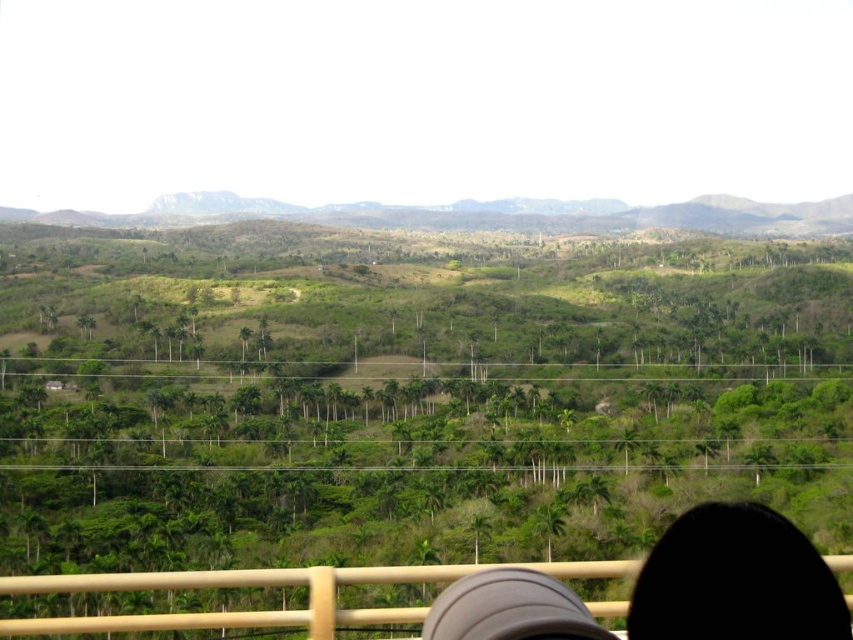
You are a hiker standing at the railing in the foreground. You notice the black hair at lower right and the green grassy hillside at upper center. Which object is shorter in height?

The black hair at lower right is shorter in height compared to the green grassy hillside at upper center as stated in the description.

You are standing on the bridge and want to compare the sizes of the objects in the scene. Which object is wider, the black hair at lower right or the green grassy hillside at upper center?

The green grassy hillside at upper center is wider than the black hair at lower right.